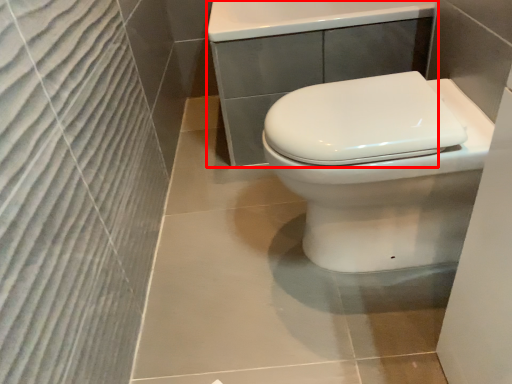
Question: From the image's perspective, where is porcelain (annotated by the red box) located relative to toilet?

Choices:
 (A) above
 (B) below

Answer: (A)